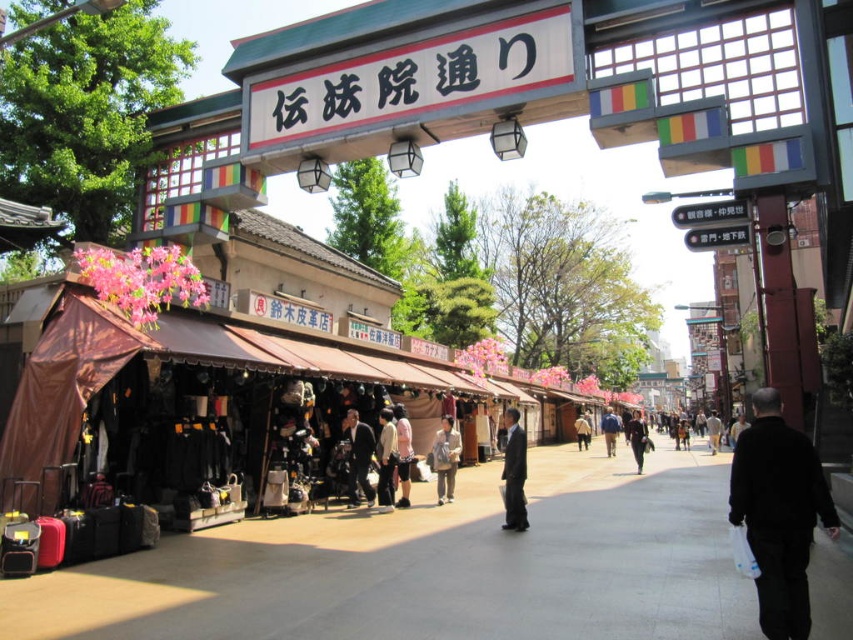
Question: Can you confirm if dark gray suit at center is positioned above black leather jacket at center?

Choices:
 (A) yes
 (B) no

Answer: (A)

Question: Among these points, which one is farthest from the camera?

Choices:
 (A) (662, 598)
 (B) (712, 428)
 (C) (367, 442)

Answer: (B)

Question: Which object is the closest to the concrete pavement at center?

Choices:
 (A) dark gray suit at center
 (B) pink fabric shorts at center
 (C) black leather jacket at center
 (D) light brown leather jacket at center

Answer: (A)

Question: Is black leather jacket at center closer to camera compared to blue fabric jacket at center?

Choices:
 (A) no
 (B) yes

Answer: (B)

Question: Among these objects, which one is farthest from the camera?

Choices:
 (A) black leather jacket at center
 (B) light beige fabric pants at center
 (C) dark suit at center
 (D) black matte jacket at lower right

Answer: (A)

Question: Does black matte jacket at lower right have a larger size compared to light beige fabric bag at center?

Choices:
 (A) yes
 (B) no

Answer: (B)